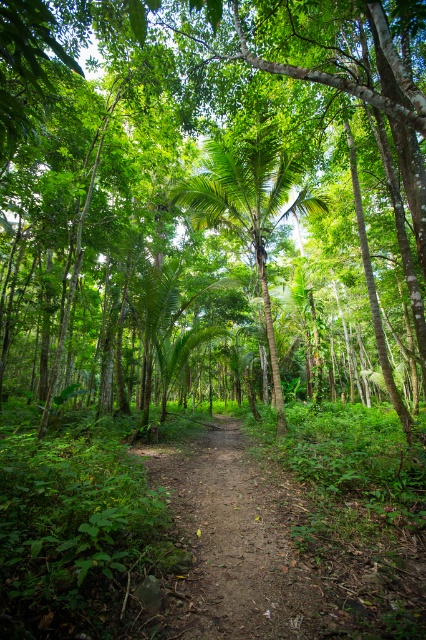
Question: Considering the real-world distances, which object is closest to the green leafy tree at center?

Choices:
 (A) dirt path at center
 (B) green leafy palm tree at center

Answer: (B)

Question: Where is green leafy tree at center located in relation to dirt path at center in the image?

Choices:
 (A) left
 (B) right

Answer: (A)

Question: Which point appears closest to the camera in this image?

Choices:
 (A) (305, 131)
 (B) (195, 500)
 (C) (229, 200)

Answer: (B)

Question: Which object is farther from the camera taking this photo?

Choices:
 (A) green leafy tree at center
 (B) green leafy palm tree at center
 (C) dirt path at center

Answer: (B)

Question: Is green leafy tree at center closer to camera compared to green leafy palm tree at center?

Choices:
 (A) yes
 (B) no

Answer: (A)

Question: Does green leafy tree at center appear on the right side of dirt path at center?

Choices:
 (A) yes
 (B) no

Answer: (B)